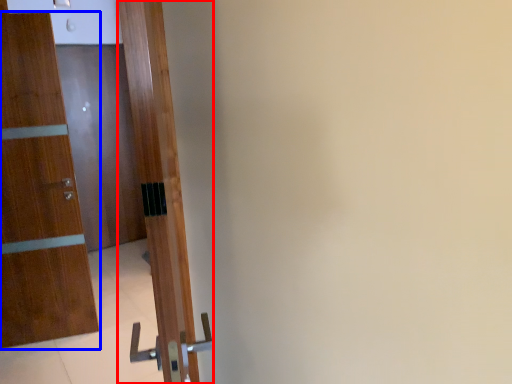
Question: Which object is further to the camera taking this photo, door (highlighted by a red box) or door (highlighted by a blue box)?

Choices:
 (A) door
 (B) door

Answer: (B)